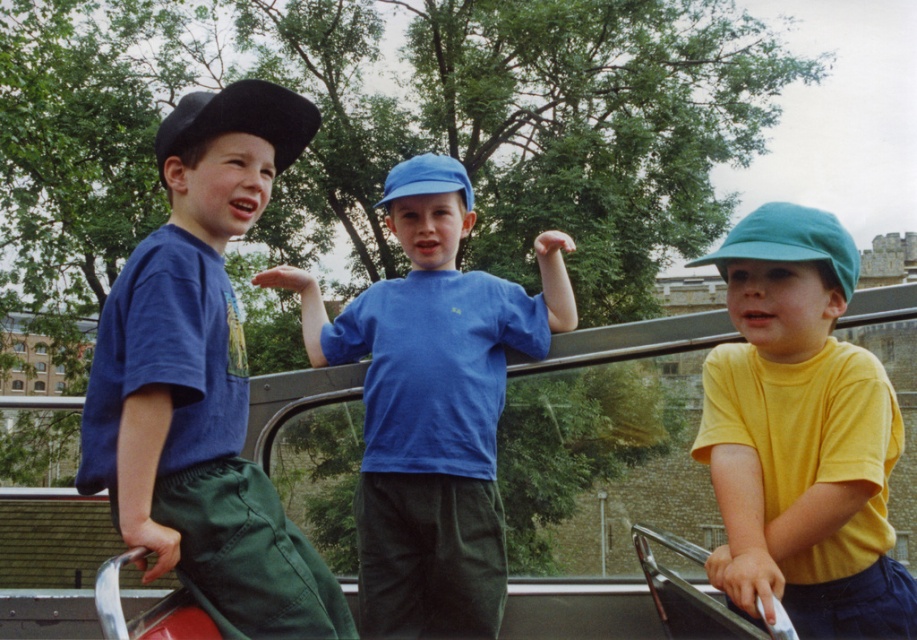
Between matte blue shirt at left and blue matte shirt at center, which one is positioned lower?

blue matte shirt at center is lower down.

Is matte blue shirt at left shorter than blue matte shirt at center?

Correct, matte blue shirt at left is not as tall as blue matte shirt at center.

Who is more distant from viewer, (214, 416) or (485, 346)?

The point (485, 346) is more distant.

This screenshot has height=640, width=917. Identify the location of matte blue shirt at left. (202, 380).

How distant is matte blue shirt at left from yellow matte shirt at center?

They are 9.40 feet apart.

Is matte blue shirt at left above yellow matte shirt at center?

Correct, matte blue shirt at left is located above yellow matte shirt at center.

Find the location of a particular element. The height and width of the screenshot is (640, 917). matte blue shirt at left is located at coordinates (202, 380).

Locate an element on the screen. matte blue shirt at left is located at coordinates (202, 380).

Between matte blue shirt at left and black matte baseball hat at left, which one has more height?

Standing taller between the two is matte blue shirt at left.

Between point (188, 348) and point (251, 128), which one is positioned behind?

The point (251, 128) is more distant.

Locate an element on the screen. Image resolution: width=917 pixels, height=640 pixels. matte blue shirt at left is located at coordinates (202, 380).